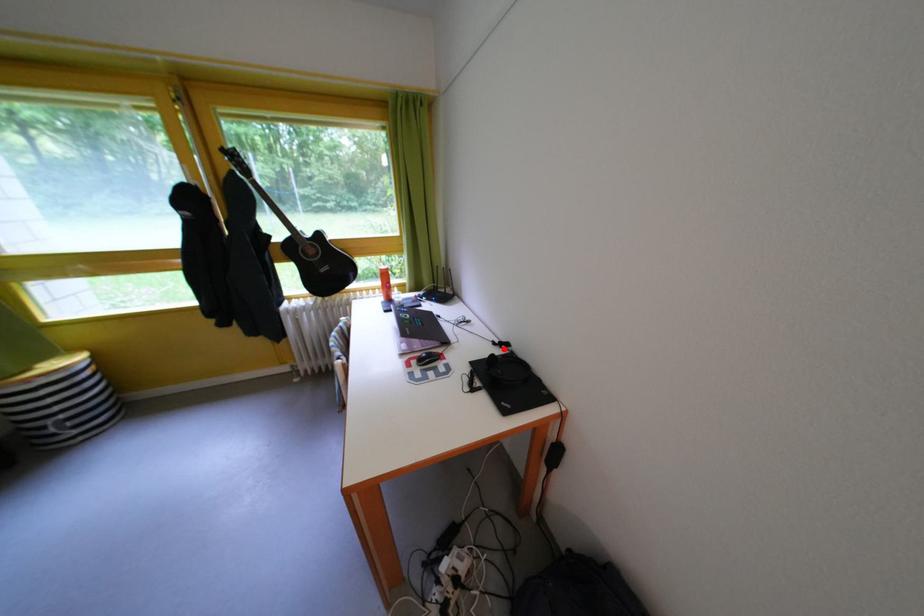
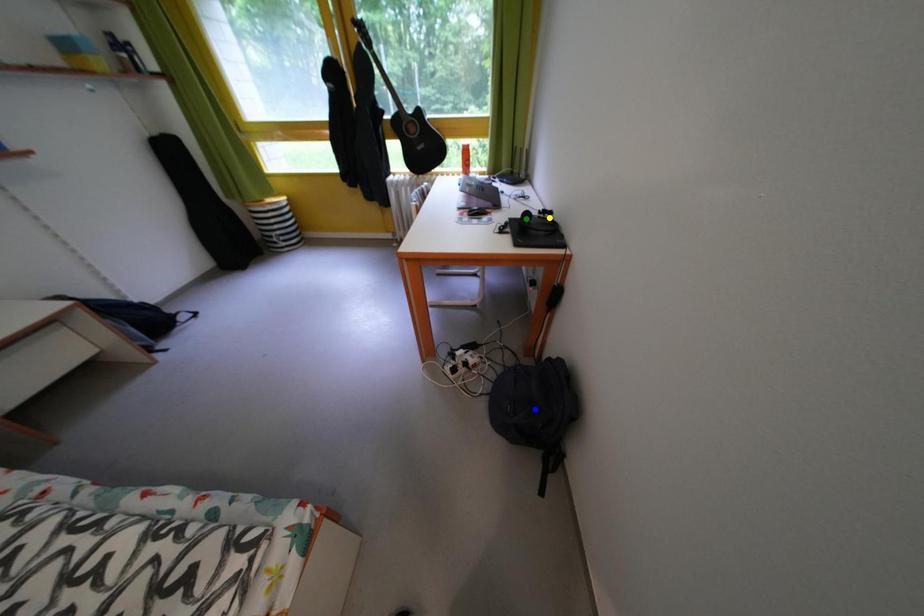
Question: I am providing you with two images of the same scene from different viewpoints. A red point is marked on the first image. You are given multiple points on the second image. Which mark in image 2 goes with the point in image 1?

Choices:
 (A) blue point
 (B) yellow point
 (C) green point

Answer: (B)